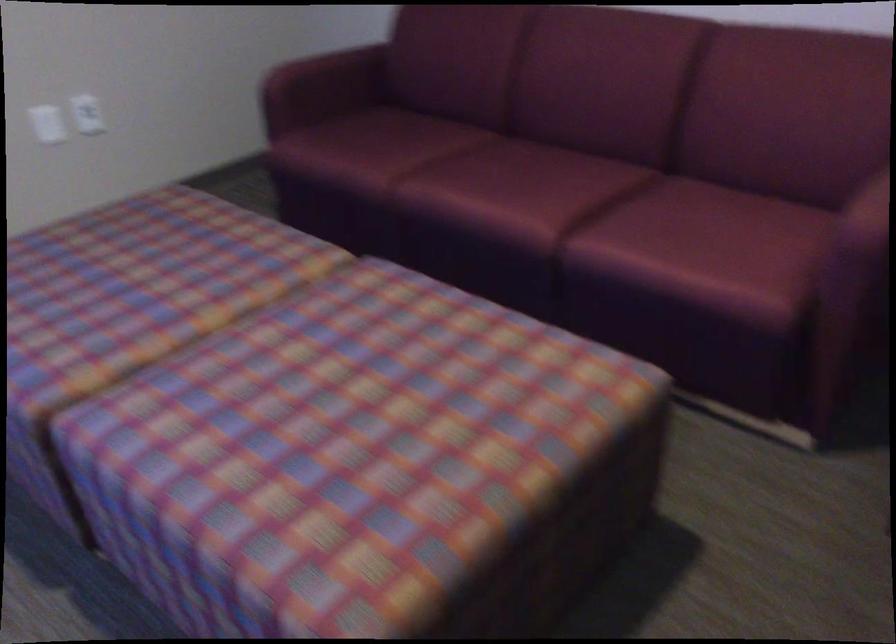
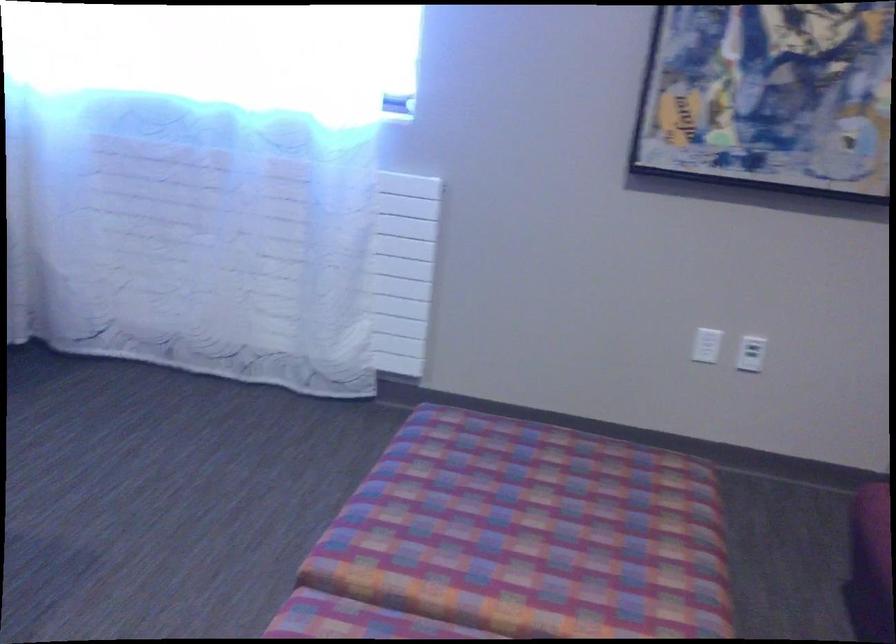
In the second image, find the point that corresponds to the point at 142,269 in the first image.

(550, 516)